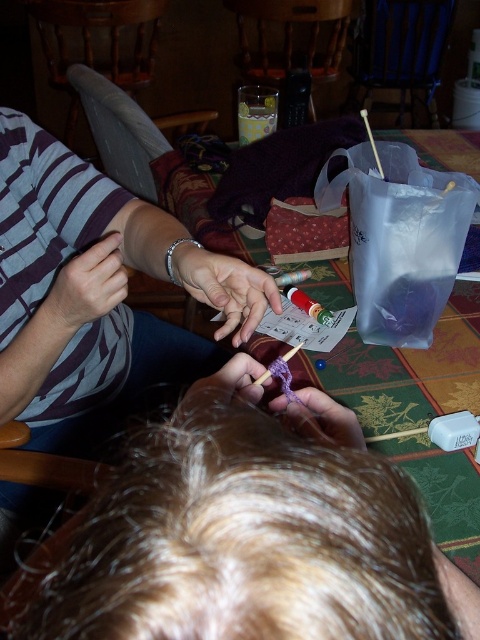
You are a robot with a 6 inch wide arm. You want to reach the yarn between the two people knitting. The blonde hair at center is in the way. Can your arm fit between them?

The two people are 7.41 inches apart, so yes, the robot arm can fit between them since it is narrower than the space available.

You are standing at the edge of the table and want to place a small ornament at the point marked by coordinates point (404, 371). Where on the table should you place it?

The point (404, 371) is on the green fabric table at center, so you should place the ornament on the green fabric table at center.